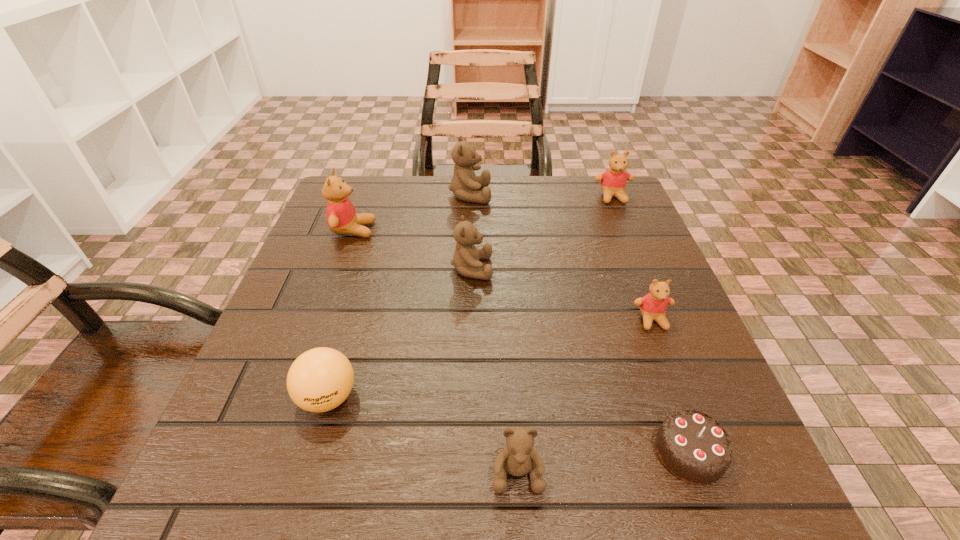
The width and height of the screenshot is (960, 540). What are the coordinates of `the smallest brown teddy bear` in the screenshot? It's located at (518, 458).

Find the location of a particular element. This screenshot has width=960, height=540. chocolate cake is located at coordinates (693, 446).

Identify the location of the shortest object. (693, 446).

Locate an element on the screen. vacant space located 0.320m on the front-facing side of the farthest brown teddy bear is located at coordinates (613, 194).

Where is `vacant space positioned 0.160m on the front-facing side of the third farthest object`? vacant space positioned 0.160m on the front-facing side of the third farthest object is located at coordinates (443, 230).

You are a GUI agent. You are given a task and a screenshot of the screen. Output one action in this format:
    pyautogui.click(x=<x>, y=<y>)
    Task: Click on the blank area located on the front-facing side of the second biggest red teddy bear
    This screenshot has height=540, width=960.
    Given the screenshot: What is the action you would take?
    pyautogui.click(x=625, y=226)

You are a GUI agent. You are given a task and a screenshot of the screen. Output one action in this format:
    pyautogui.click(x=<x>, y=<y>)
    Task: Click on the vacant point located 0.290m on the front-facing side of the fourth farthest object
    The width and height of the screenshot is (960, 540).
    Given the screenshot: What is the action you would take?
    pyautogui.click(x=629, y=268)

Locate an element on the screen. vacant point located 0.100m on the side with brand of the ping-pong ball is located at coordinates click(300, 494).

Image resolution: width=960 pixels, height=540 pixels. I want to click on vacant space located on the front-facing side of the fifth farthest object, so click(709, 468).

The image size is (960, 540). I want to click on free space located 0.230m on the back of the chocolate chocolate cake, so click(638, 312).